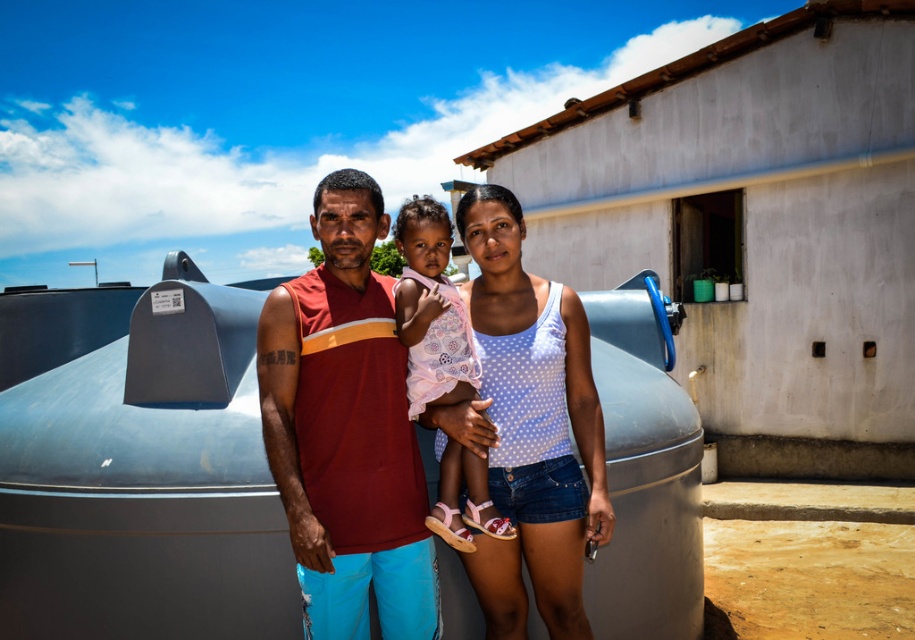
You are a photographer trying to capture the child in the pink polka dot dress at center. The brushed metal water tank at center is blocking your view. Can you move to the side to get a clear shot of the child?

The pink polka dot dress at center is behind the brushed metal water tank at center, so moving to the side might allow you to see around the tank and capture the child.

You are a painter who needs to paint the brushed metal water tank at center and the maroon sleeveless shirt at center. Which object requires more paint due to its larger size?

The brushed metal water tank at center requires more paint because it has a larger size compared to the maroon sleeveless shirt at center.

You are standing in front of the large cylindrical tank and want to locate the maroon sleeveless shirt at center. According to the coordinates provided, where would you look to find it?

The maroon sleeveless shirt at center is located at point coordinates of (346,429).